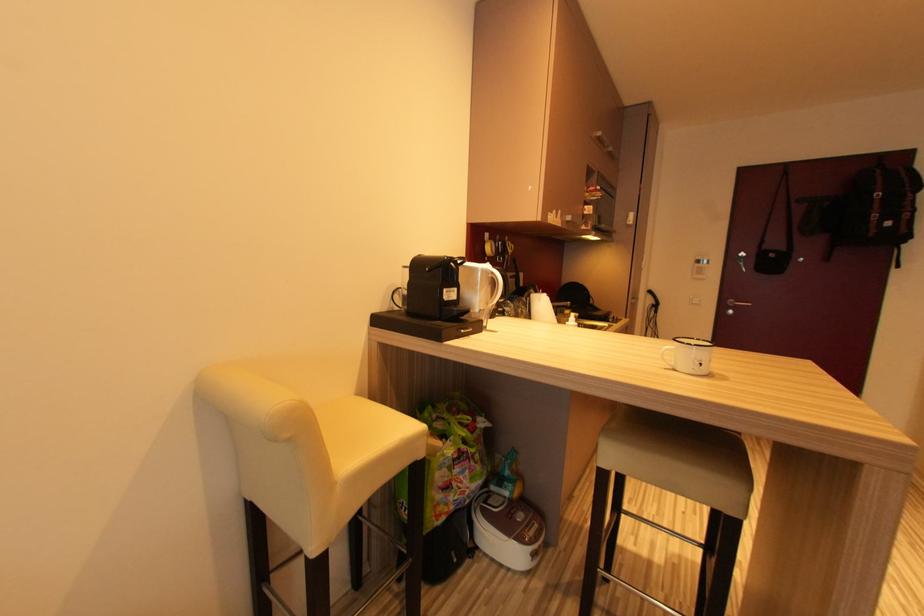
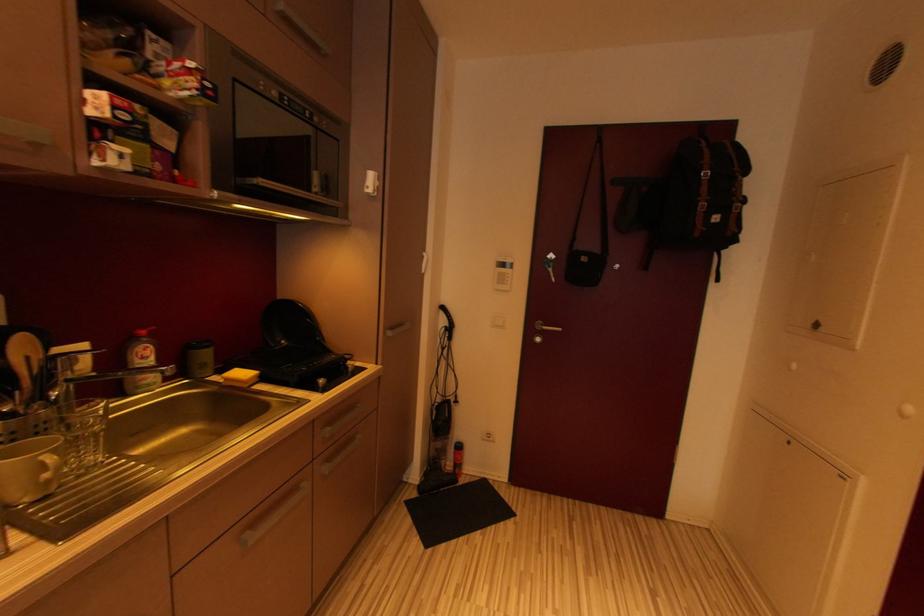
What movement of the cameraman would produce the second image?

The cameraman moved toward right, forward.